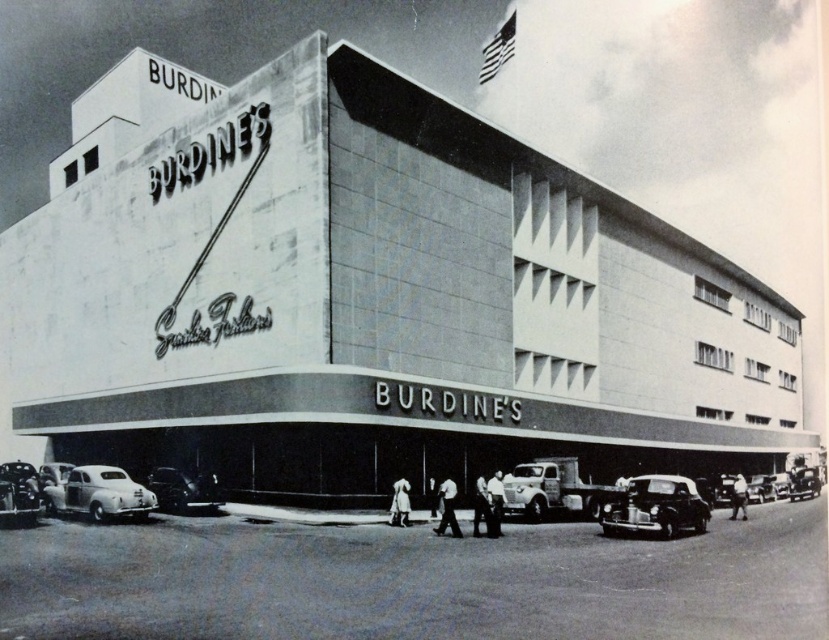
Question: Is shiny black car at lower right to the left of shiny silver car at lower left from the viewer's perspective?

Choices:
 (A) yes
 (B) no

Answer: (B)

Question: Which of the following is the closest to the observer?

Choices:
 (A) (99, 476)
 (B) (663, 516)
 (C) (146, 124)

Answer: (B)

Question: Does metallic silver truck at center appear on the left side of shiny silver sedan at lower left?

Choices:
 (A) no
 (B) yes

Answer: (A)

Question: In this image, where is metallic silver truck at center located relative to shiny black car at lower right?

Choices:
 (A) below
 (B) above

Answer: (B)

Question: Which point is farther to the camera?

Choices:
 (A) click(x=691, y=515)
 (B) click(x=165, y=493)
 (C) click(x=100, y=515)
 (D) click(x=582, y=272)

Answer: (D)

Question: Which of these objects is positioned farthest from the metallic silver truck at center?

Choices:
 (A) shiny silver car at lower left
 (B) shiny black car at lower right
 (C) smooth concrete building at center
 (D) shiny silver sedan at lower left

Answer: (A)